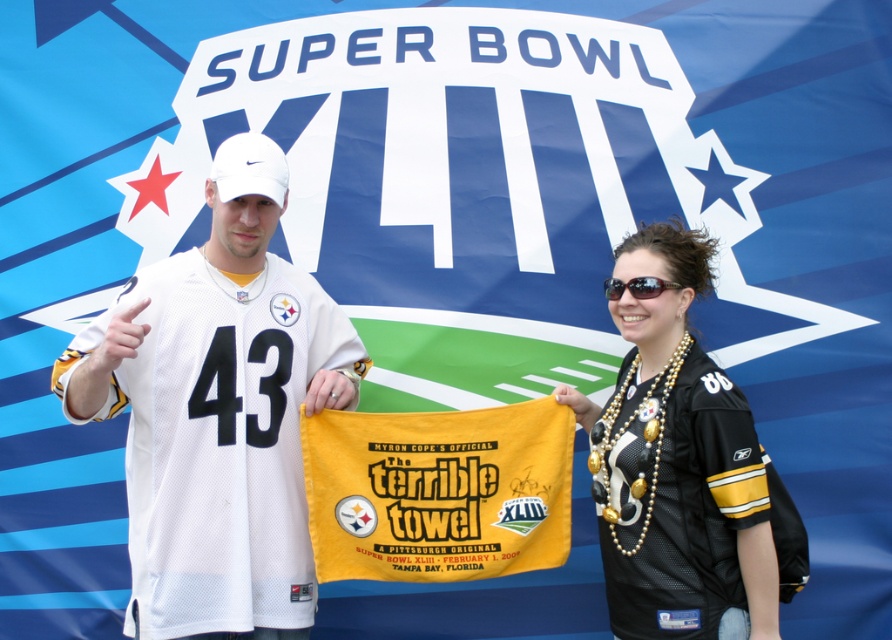
The width and height of the screenshot is (892, 640). What do you see at coordinates (676, 465) in the screenshot?
I see `black jersey at center` at bounding box center [676, 465].

Can you confirm if black jersey at center is positioned to the right of black plastic sunglasses at upper center?

Yes, black jersey at center is to the right of black plastic sunglasses at upper center.

Does point (684, 248) lie in front of point (634, 285)?

No, (684, 248) is further to viewer.

This screenshot has width=892, height=640. What are the coordinates of `black jersey at center` in the screenshot? It's located at 676,465.

Is white jersey at center shorter than black plastic sunglasses at upper center?

No.

Is white jersey at center above black plastic sunglasses at upper center?

No, white jersey at center is not above black plastic sunglasses at upper center.

Is point (180, 276) positioned behind point (605, 282)?

No, it is not.

You are a GUI agent. You are given a task and a screenshot of the screen. Output one action in this format:
    pyautogui.click(x=<x>, y=<y>)
    Task: Click on the white jersey at center
    The width and height of the screenshot is (892, 640).
    Given the screenshot: What is the action you would take?
    pyautogui.click(x=219, y=412)

Which is above, white jersey at center or black jersey at center?

white jersey at center

Does point (293, 596) come farther from viewer compared to point (639, 472)?

Yes.

Identify the location of white jersey at center. The width and height of the screenshot is (892, 640). (219, 412).